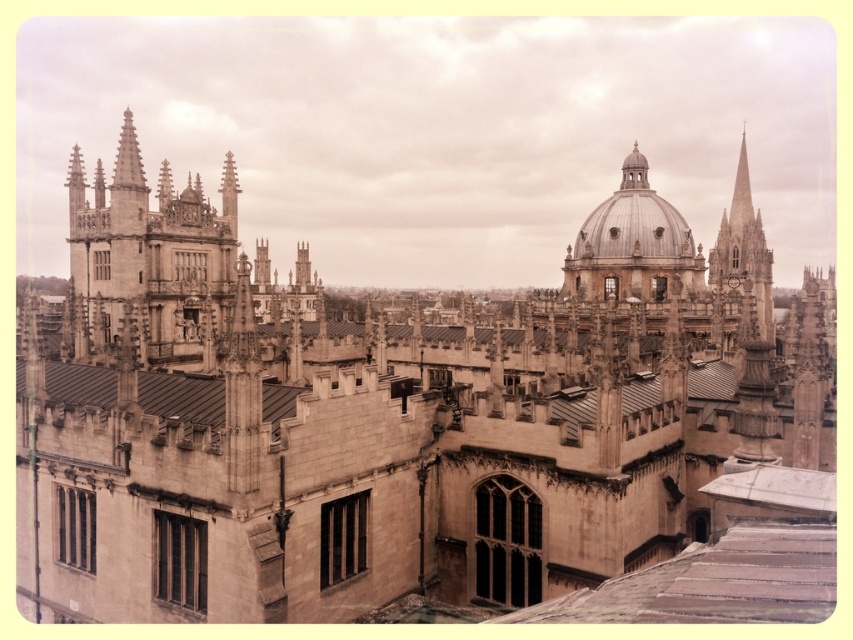
Is silver dome at center bigger than smooth stone spire at right?

Actually, silver dome at center might be smaller than smooth stone spire at right.

From the picture: Can you confirm if silver dome at center is smaller than smooth stone spire at right?

Yes, silver dome at center is smaller than smooth stone spire at right.

This screenshot has height=640, width=853. Find the location of `silver dome at center`. silver dome at center is located at coordinates (631, 244).

Who is lower down, silver dome at center or white marble roof at lower right?

white marble roof at lower right

Is silver dome at center positioned before white marble roof at lower right?

No, silver dome at center is further to the viewer.

Find the location of `silver dome at center`. silver dome at center is located at coordinates (631, 244).

This screenshot has height=640, width=853. In order to click on silver dome at center in this screenshot , I will do `click(631, 244)`.

Which of these two, brown metal roof at center or white marble roof at lower right, stands taller?

white marble roof at lower right

Who is positioned more to the left, brown metal roof at center or white marble roof at lower right?

From the viewer's perspective, brown metal roof at center appears more on the left side.

Is point (142, 384) in front of point (813, 486)?

That is False.

Locate an element on the screen. brown metal roof at center is located at coordinates (183, 396).